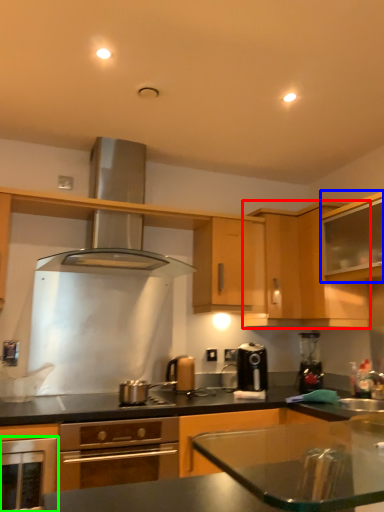
Question: Estimate the real-world distances between objects in this image. Which object is closer to cabinetry (highlighted by a red box), cabinetry (highlighted by a blue box) or oven (highlighted by a green box)?

Choices:
 (A) cabinetry
 (B) oven

Answer: (A)